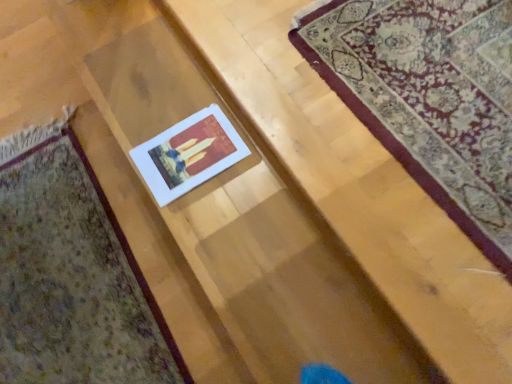
Question: From a real-world perspective, is white paper at center positioned above or below matte paper card at center?

Choices:
 (A) below
 (B) above

Answer: (B)

Question: Is point click(x=272, y=230) closer or farther from the camera than point click(x=30, y=297)?

Choices:
 (A) closer
 (B) farther

Answer: (A)

Question: Estimate the real-world distances between objects in this image. Which object is farther from the white paper at center?

Choices:
 (A) matte paper card at center
 (B) white paper at center

Answer: (A)

Question: Which object is positioned farthest from the matte paper card at center?

Choices:
 (A) white paper at center
 (B) white paper at center

Answer: (B)